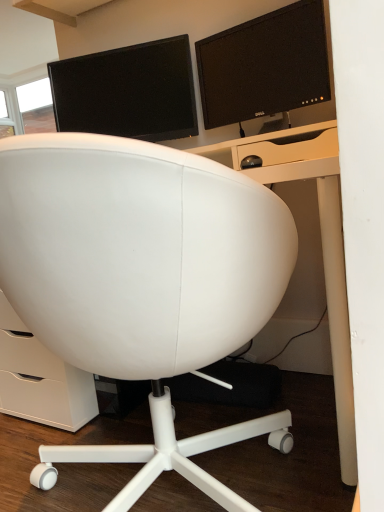
What do you see at coordinates (142, 281) in the screenshot?
I see `white leather chair at center` at bounding box center [142, 281].

Measure the distance between white leather chair at center and camera.

white leather chair at center and camera are 23.80 inches apart from each other.

This screenshot has height=512, width=384. Describe the element at coordinates (264, 66) in the screenshot. I see `matte black monitor at upper center, acting as the second computer monitor starting from the left` at that location.

Identify the location of matte black monitor at upper center, acting as the second computer monitor starting from the left. (264, 66).

At what (x,y) coordinates should I click in order to perform the action: click on matte black monitor at upper center, which ranks as the second computer monitor in right-to-left order. Please return your answer as a coordinate pair (x, y). The width and height of the screenshot is (384, 512). Looking at the image, I should click on (128, 92).

Measure the distance between matte black monitor at upper center, positioned as the first computer monitor in right-to-left order, and matte black monitor at upper center, which ranks as the second computer monitor in right-to-left order.

matte black monitor at upper center, positioned as the first computer monitor in right-to-left order, is 27.32 centimeters from matte black monitor at upper center, which ranks as the second computer monitor in right-to-left order.

Which is behind, matte black monitor at upper center, acting as the second computer monitor starting from the left, or matte black monitor at upper center, which ranks as the second computer monitor in right-to-left order?

matte black monitor at upper center, which ranks as the second computer monitor in right-to-left order.

Considering the positions of points (261, 58) and (82, 63), is point (261, 58) farther from camera compared to point (82, 63)?

No, (261, 58) is in front of (82, 63).

Is matte black monitor at upper center, acting as the second computer monitor starting from the left, turned away from matte black monitor at upper center, which ranks as the second computer monitor in right-to-left order?

No, matte black monitor at upper center, acting as the second computer monitor starting from the left, is not facing away from matte black monitor at upper center, which ranks as the second computer monitor in right-to-left order.

Is the position of matte black monitor at upper center, acting as the second computer monitor starting from the left, more distant than that of white leather chair at center?

Yes, matte black monitor at upper center, acting as the second computer monitor starting from the left, is further from the viewer.

The width and height of the screenshot is (384, 512). There is a white leather chair at center. Find the location of `the 2nd computer monitor above it (from the image's perspective)`. the 2nd computer monitor above it (from the image's perspective) is located at coordinates (264, 66).

Is matte black monitor at upper center, positioned as the first computer monitor in right-to-left order, taller or shorter than white leather chair at center?

In the image, matte black monitor at upper center, positioned as the first computer monitor in right-to-left order, appears to be shorter than white leather chair at center.

From the image's perspective, would you say matte black monitor at upper center, which is counted as the first computer monitor, starting from the left, is positioned over white leather chair at center?

Yes, from the image's perspective, matte black monitor at upper center, which is counted as the first computer monitor, starting from the left, is on top of white leather chair at center.

From a real-world perspective, is matte black monitor at upper center, which ranks as the second computer monitor in right-to-left order, physically above white leather chair at center?

Yes.

Is matte black monitor at upper center, which ranks as the second computer monitor in right-to-left order, not near white leather chair at center?

→ No.

Looking at this image, is matte black monitor at upper center, which is counted as the first computer monitor, starting from the left, smaller than white leather chair at center?

Yes, matte black monitor at upper center, which is counted as the first computer monitor, starting from the left, is smaller than white leather chair at center.

Which object is further away from the camera, white leather chair at center or matte black monitor at upper center, which ranks as the second computer monitor in right-to-left order?

matte black monitor at upper center, which ranks as the second computer monitor in right-to-left order, is more distant.

Which is more to the right, white leather chair at center or matte black monitor at upper center, which is counted as the first computer monitor, starting from the left?

Positioned to the right is white leather chair at center.

Is white leather chair at center turned away from matte black monitor at upper center, which ranks as the second computer monitor in right-to-left order?

No, white leather chair at center is not facing away from matte black monitor at upper center, which ranks as the second computer monitor in right-to-left order.

Considering the points (39, 283) and (185, 52), which point is behind, point (39, 283) or point (185, 52)?

The point (185, 52) is farther from the camera.

Find the location of `computer monitor that is on the right side of white leather chair at center`. computer monitor that is on the right side of white leather chair at center is located at coordinates (264, 66).

From a real-world perspective, is white leather chair at center physically located above or below matte black monitor at upper center, acting as the second computer monitor starting from the left?

white leather chair at center is situated lower than matte black monitor at upper center, acting as the second computer monitor starting from the left, in the real world.

In the scene shown: Who is taller, white leather chair at center or matte black monitor at upper center, positioned as the first computer monitor in right-to-left order?

With more height is white leather chair at center.

Is white leather chair at center not inside matte black monitor at upper center, acting as the second computer monitor starting from the left?

Yes, white leather chair at center is not within matte black monitor at upper center, acting as the second computer monitor starting from the left.

Based on the photo, is matte black monitor at upper center, which is counted as the first computer monitor, starting from the left, oriented away from matte black monitor at upper center, acting as the second computer monitor starting from the left?

That's not correct — matte black monitor at upper center, which is counted as the first computer monitor, starting from the left, is not looking away from matte black monitor at upper center, acting as the second computer monitor starting from the left.

Does matte black monitor at upper center, which is counted as the first computer monitor, starting from the left, have a greater height compared to matte black monitor at upper center, positioned as the first computer monitor in right-to-left order?

Indeed, matte black monitor at upper center, which is counted as the first computer monitor, starting from the left, has a greater height compared to matte black monitor at upper center, positioned as the first computer monitor in right-to-left order.

Is matte black monitor at upper center, which is counted as the first computer monitor, starting from the left, directly adjacent to matte black monitor at upper center, acting as the second computer monitor starting from the left?

They are not placed beside each other.

In terms of size, does matte black monitor at upper center, which ranks as the second computer monitor in right-to-left order, appear bigger or smaller than matte black monitor at upper center, positioned as the first computer monitor in right-to-left order?

Clearly, matte black monitor at upper center, which ranks as the second computer monitor in right-to-left order, is larger in size than matte black monitor at upper center, positioned as the first computer monitor in right-to-left order.

In order to click on computer monitor lying below the matte black monitor at upper center, positioned as the first computer monitor in right-to-left order (from the image's perspective) in this screenshot , I will do click(128, 92).

Locate an element on the screen. This screenshot has width=384, height=512. chair on the left of matte black monitor at upper center, acting as the second computer monitor starting from the left is located at coordinates (142, 281).

From the picture: Based on their spatial positions, is matte black monitor at upper center, which ranks as the second computer monitor in right-to-left order, or white leather chair at center closer to matte black monitor at upper center, positioned as the first computer monitor in right-to-left order?

The object closer to matte black monitor at upper center, positioned as the first computer monitor in right-to-left order, is matte black monitor at upper center, which ranks as the second computer monitor in right-to-left order.

From the image, which object appears to be nearer to matte black monitor at upper center, positioned as the first computer monitor in right-to-left order, white leather chair at center or matte black monitor at upper center, which is counted as the first computer monitor, starting from the left?

matte black monitor at upper center, which is counted as the first computer monitor, starting from the left, is closer to matte black monitor at upper center, positioned as the first computer monitor in right-to-left order.

Which object lies nearer to the anchor point matte black monitor at upper center, which is counted as the first computer monitor, starting from the left, white leather chair at center or matte black monitor at upper center, positioned as the first computer monitor in right-to-left order?

The object closer to matte black monitor at upper center, which is counted as the first computer monitor, starting from the left, is matte black monitor at upper center, positioned as the first computer monitor in right-to-left order.

Based on their spatial positions, is matte black monitor at upper center, acting as the second computer monitor starting from the left, or matte black monitor at upper center, which ranks as the second computer monitor in right-to-left order, further from white leather chair at center?

The object further to white leather chair at center is matte black monitor at upper center, which ranks as the second computer monitor in right-to-left order.

Looking at the image, which one is located further to white leather chair at center, matte black monitor at upper center, which ranks as the second computer monitor in right-to-left order, or matte black monitor at upper center, positioned as the first computer monitor in right-to-left order?

matte black monitor at upper center, which ranks as the second computer monitor in right-to-left order, is positioned further to the anchor white leather chair at center.

When comparing their distances from matte black monitor at upper center, which ranks as the second computer monitor in right-to-left order, does matte black monitor at upper center, positioned as the first computer monitor in right-to-left order, or white leather chair at center seem further?

The object further to matte black monitor at upper center, which ranks as the second computer monitor in right-to-left order, is white leather chair at center.

Identify the location of computer monitor between white leather chair at center and matte black monitor at upper center, which is counted as the first computer monitor, starting from the left, in the front-back direction. (264, 66).